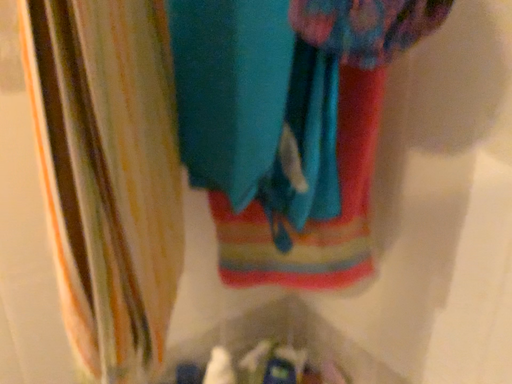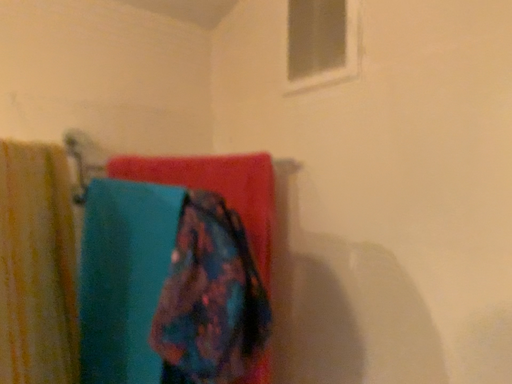
Question: Which way did the camera rotate in the video?

Choices:
 (A) rotated upward
 (B) rotated downward

Answer: (A)